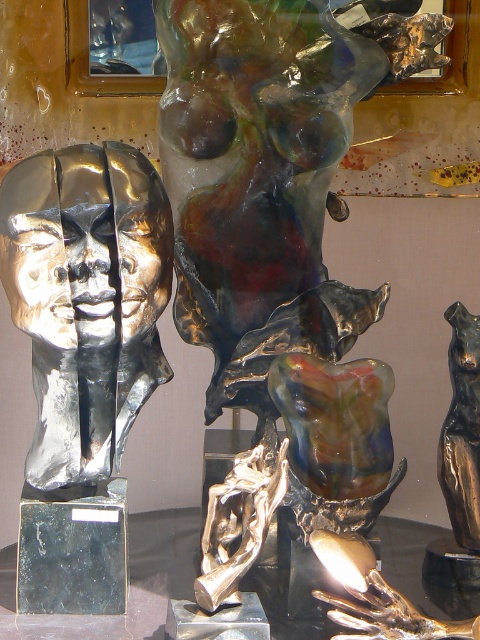
You are an art curator planning to install a new light fixture that needs to be 2 meters tall. Considering the height of the shiny bronze sculpture at center and the shiny metallic head at left, which sculpture would be suitable to place the light fixture next to without blocking the view of the other sculpture?

The shiny bronze sculpture at center is taller than the shiny metallic head at left, so placing the light fixture next to the shiny metallic head at left would prevent blocking the view of the taller shiny bronze sculpture at center.

Consider the image. Based on the provided coordinates, where is the shiny bronze sculpture at center located in the image?

The shiny bronze sculpture at center is located at point (273, 232).